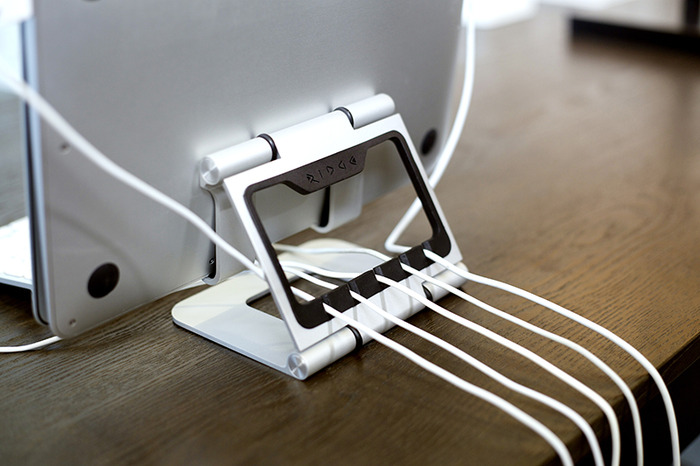
Locate an element on the screen. The image size is (700, 466). cords is located at coordinates (638, 359), (620, 380), (598, 406), (586, 420), (565, 437).